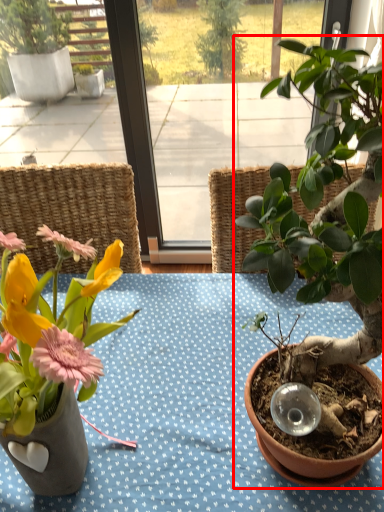
Question: From the image's perspective, considering the relative positions of houseplant (annotated by the red box) and flower in the image provided, where is houseplant (annotated by the red box) located with respect to the staircase?

Choices:
 (A) above
 (B) below

Answer: (A)